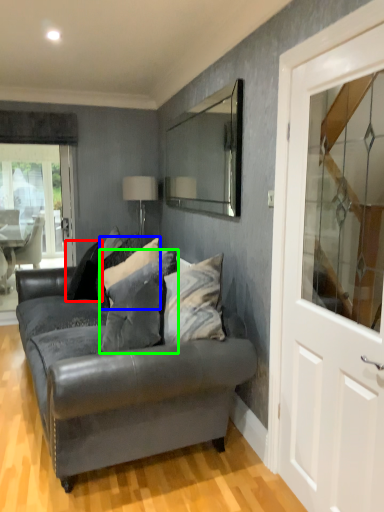
Question: Estimate the real-world distances between objects in this image. Which object is farther from pillow (highlighted by a red box), pillow (highlighted by a blue box) or pillow (highlighted by a green box)?

Choices:
 (A) pillow
 (B) pillow

Answer: (B)